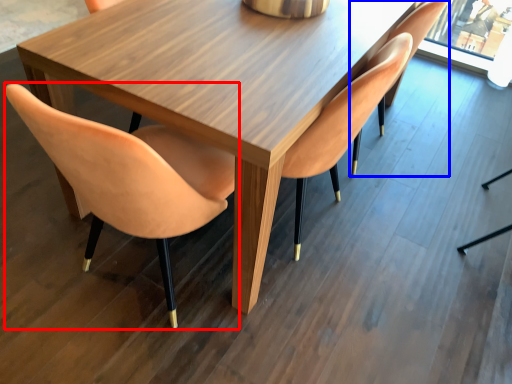
Question: Which of the following is the farthest to the observer, chair (highlighted by a red box) or chair (highlighted by a blue box)?

Choices:
 (A) chair
 (B) chair

Answer: (B)